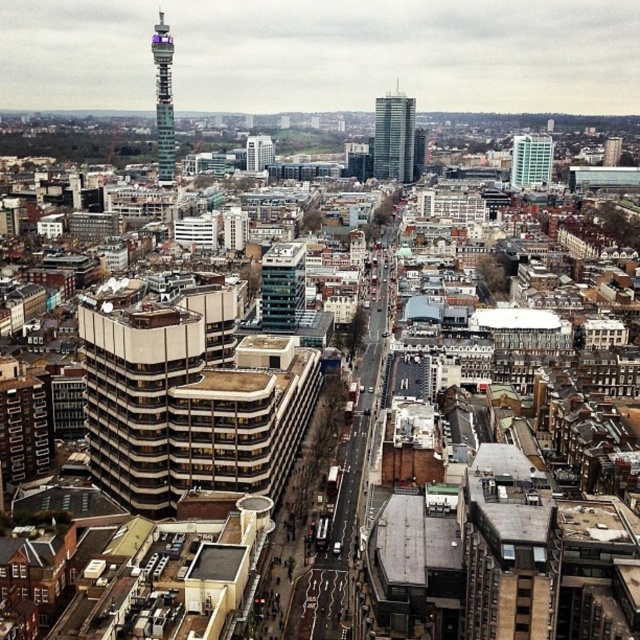
Measure the distance between point (168, 83) and camera.

Point (168, 83) is 510.22 meters from camera.

Between metallic glass tower at upper left and white glass building at center, which one has less height?

white glass building at center

Which is in front, point (173, 161) or point (250, 140)?

Positioned in front is point (173, 161).

The width and height of the screenshot is (640, 640). In order to click on metallic glass tower at upper left in this screenshot , I will do `click(163, 99)`.

Is point (273, 305) behind point (394, 132)?

No, (273, 305) is closer to viewer.

Find the location of a particular element. This screenshot has height=640, width=640. green glass building at center is located at coordinates (282, 285).

Between metallic glass tower at upper left and glassy teal skyscraper at upper right, which one is positioned higher?

metallic glass tower at upper left is higher up.

At what (x,y) coordinates should I click in order to perform the action: click on metallic glass tower at upper left. Please return your answer as a coordinate pair (x, y). This screenshot has height=640, width=640. Looking at the image, I should click on (163, 99).

Find the location of a particular element. metallic glass tower at upper left is located at coordinates (163, 99).